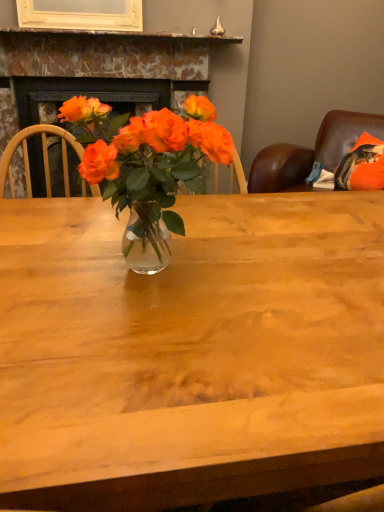
Question: In the image, is marble fireplace at upper center positioned in front of or behind translucent glass vase at center?

Choices:
 (A) behind
 (B) front

Answer: (A)

Question: Is marble fireplace at upper center taller or shorter than translucent glass vase at center?

Choices:
 (A) short
 (B) tall

Answer: (B)

Question: Do you think marble fireplace at upper center is within translucent glass vase at center, or outside of it?

Choices:
 (A) outside
 (B) inside

Answer: (A)

Question: Is point (165, 237) positioned closer to the camera than point (59, 31)?

Choices:
 (A) farther
 (B) closer

Answer: (B)

Question: From the image's perspective, is translucent glass vase at center above or below marble fireplace at upper center?

Choices:
 (A) below
 (B) above

Answer: (A)

Question: In terms of size, does translucent glass vase at center appear bigger or smaller than marble fireplace at upper center?

Choices:
 (A) small
 (B) big

Answer: (A)

Question: Based on their positions, is translucent glass vase at center located to the left or right of marble fireplace at upper center?

Choices:
 (A) left
 (B) right

Answer: (B)